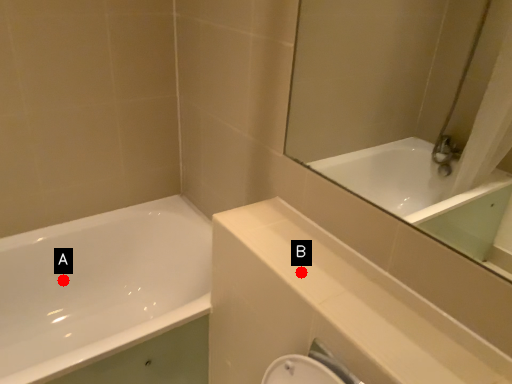
Question: Two points are circled on the image, labeled by A and B beside each circle. Among these points, which one is farthest from the camera?

Choices:
 (A) A is further
 (B) B is further

Answer: (A)